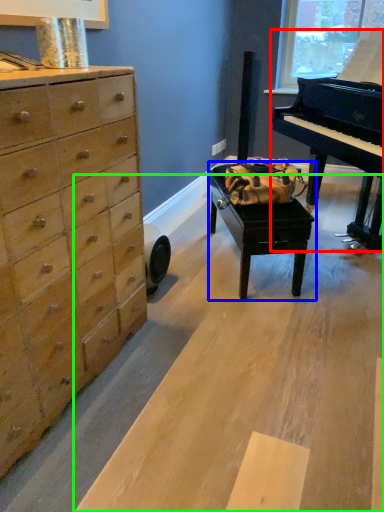
Question: Which object is positioned closest to piano (highlighted by a red box)? Select from table (highlighted by a blue box) and plywood (highlighted by a green box).

Choices:
 (A) table
 (B) plywood

Answer: (A)